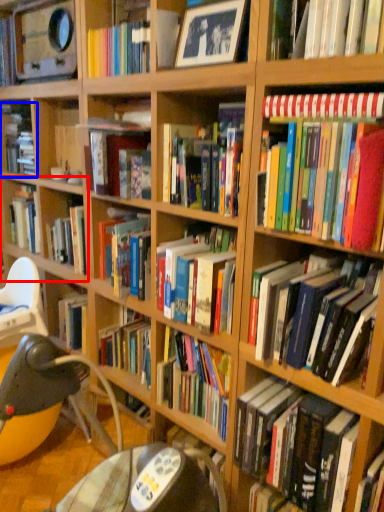
Question: Which point is closer to the camera, shelf (highlighted by a red box) or book (highlighted by a blue box)?

Choices:
 (A) shelf
 (B) book

Answer: (A)